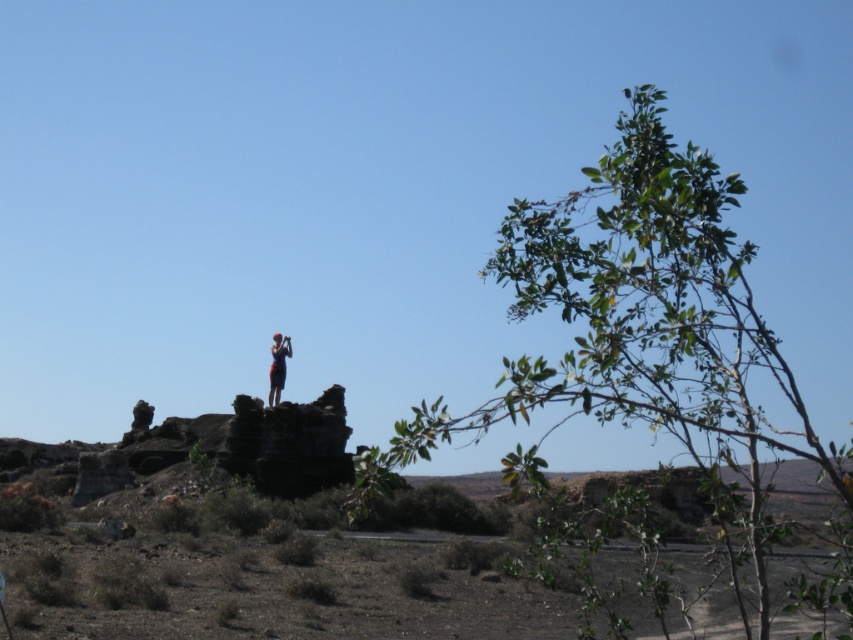
You are planning to take a photo of the red fabric person at center and the green leafy tree at upper right. Which object should you focus on if you want the one that is bigger in the frame?

The green leafy tree at upper right is larger in size than the red fabric person at center, so you should focus on the green leafy tree at upper right to capture it bigger in the frame.

You are planning to take a photo of the red fabric person at center from the green leafy tree at upper right. Given that the camera you have can capture subjects up to 200 feet away, will you be able to get a clear photo?

The distance between the green leafy tree at upper right and the red fabric person at center is 232.57 feet, which exceeds the camera range of 200 feet. Therefore, you won not be able to capture a clear photo from that position.